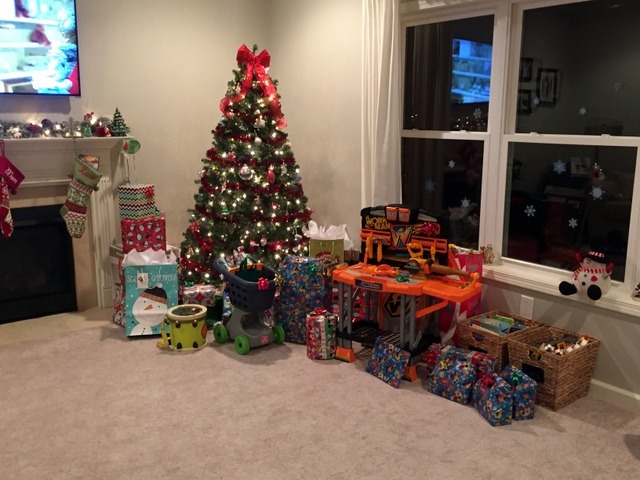
Identify the location of windows. The height and width of the screenshot is (480, 640). (463, 95), (440, 172), (546, 188), (566, 85).